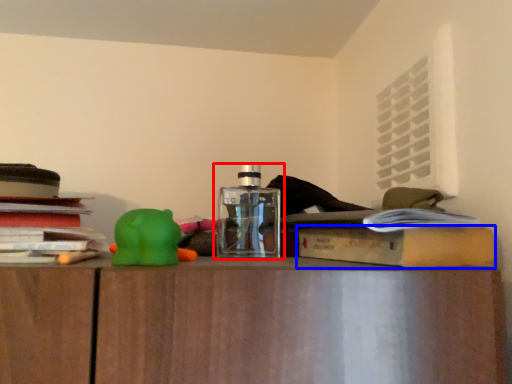
Question: Which object is closer to the camera taking this photo, bottle (highlighted by a red box) or paperback book (highlighted by a blue box)?

Choices:
 (A) bottle
 (B) paperback book

Answer: (B)